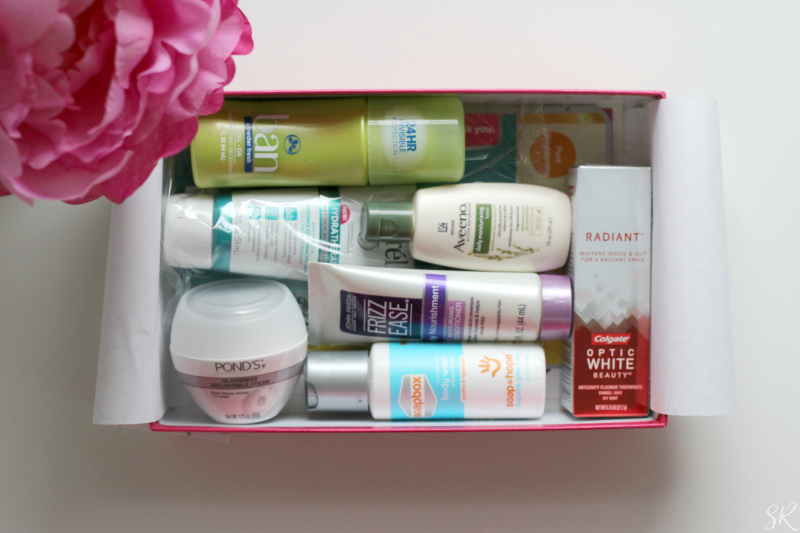
Locate an element on the screen. box is located at coordinates (145, 335), (674, 292), (337, 425), (413, 91).